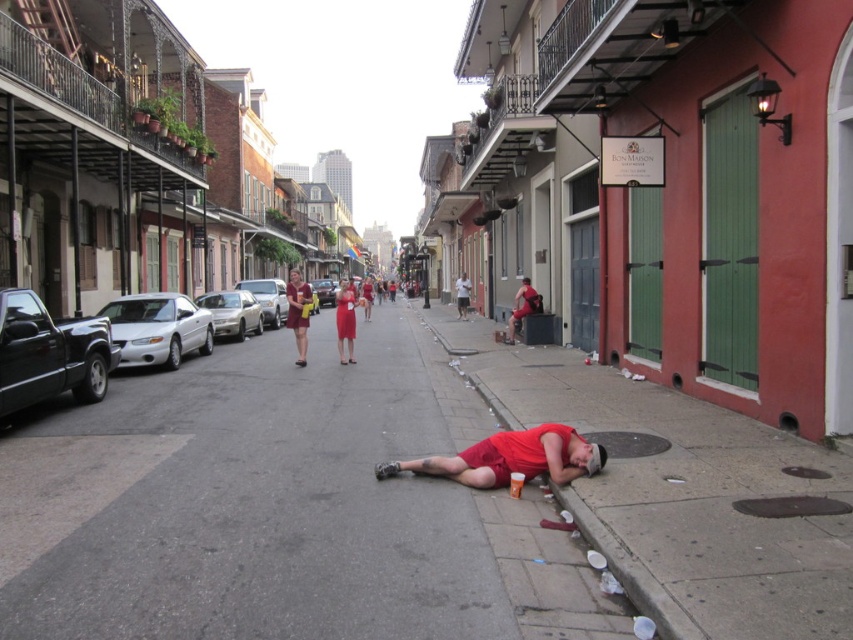
Does matte red shorts at lower center have a greater height compared to white cotton t-shirt at center?

In fact, matte red shorts at lower center may be shorter than white cotton t-shirt at center.

Is matte red shorts at lower center closer to the viewer compared to white cotton t-shirt at center?

That is True.

Who is more distant from viewer, (541, 464) or (463, 298)?

Point (463, 298)

Locate an element on the screen. Image resolution: width=853 pixels, height=640 pixels. matte red shorts at lower center is located at coordinates (511, 458).

From the picture: Which is more to the right, maroon dress at center or matte red dress at center?

Positioned to the right is matte red dress at center.

Is maroon dress at center bigger than matte red dress at center?

No.

Is point (303, 284) positioned in front of point (350, 337)?

Yes, point (303, 284) is in front of point (350, 337).

Locate an element on the screen. maroon dress at center is located at coordinates (299, 312).

Locate an element on the screen. The image size is (853, 640). matte red shorts at center is located at coordinates (521, 307).

This screenshot has width=853, height=640. What do you see at coordinates (521, 307) in the screenshot? I see `matte red shorts at center` at bounding box center [521, 307].

At what (x,y) coordinates should I click in order to perform the action: click on matte red shorts at center. Please return your answer as a coordinate pair (x, y). Looking at the image, I should click on (521, 307).